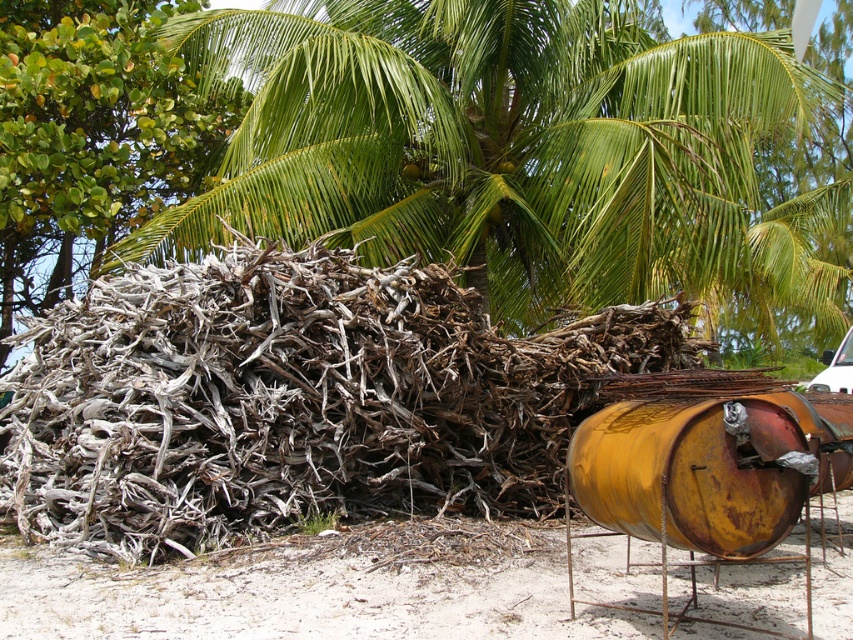
You are a photographer setting up a shot of the driftwood pile in the tropical scene. You have two points marked on your viewfinder at coordinates point (199, 218) and point (518, 480). Which point is closer to your camera lens?

Point (199, 218) is further to the camera than point (518, 480), so the point closer to the camera lens is point (199, 218).